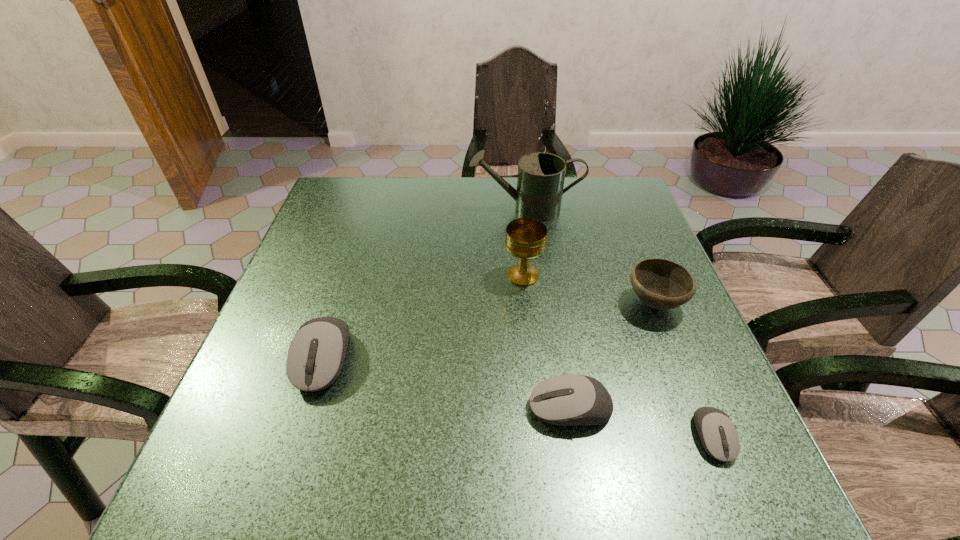
Identify the location of the leftmost computer equipment. This screenshot has height=540, width=960. (316, 354).

Locate an element on the screen. the second computer equipment from right to left is located at coordinates (567, 400).

You are a GUI agent. You are given a task and a screenshot of the screen. Output one action in this format:
    pyautogui.click(x=<x>, y=<y>)
    Task: Click on the fifth tallest object
    The width and height of the screenshot is (960, 540).
    Given the screenshot: What is the action you would take?
    pyautogui.click(x=567, y=400)

I want to click on the rightmost computer equipment, so click(718, 435).

You are a GUI agent. You are given a task and a screenshot of the screen. Output one action in this format:
    pyautogui.click(x=<x>, y=<y>)
    Task: Click on the shortest computer equipment
    
    Given the screenshot: What is the action you would take?
    pyautogui.click(x=718, y=435)

The image size is (960, 540). I want to click on chalice, so click(x=526, y=238).

Identify the location of the farthest object. The height and width of the screenshot is (540, 960). (540, 180).

Image resolution: width=960 pixels, height=540 pixels. What are the coordinates of `the tallest object` in the screenshot? It's located at (540, 180).

Find the location of a particular element. This screenshot has height=540, width=960. bowl is located at coordinates tap(662, 284).

You are a GUI agent. You are given a task and a screenshot of the screen. Output one action in this format:
    pyautogui.click(x=<x>, y=<y>)
    Task: Click on the vacant position located 0.070m on the wheel side of the leftmost object
    This screenshot has height=540, width=960.
    Given the screenshot: What is the action you would take?
    pyautogui.click(x=300, y=433)